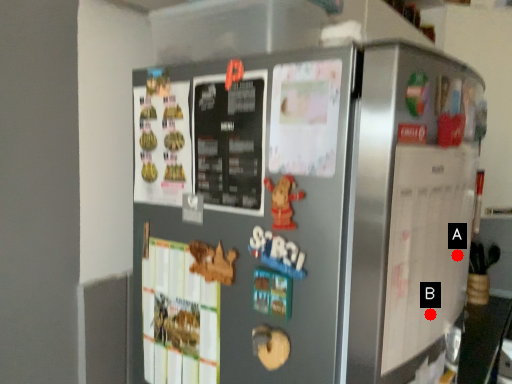
Question: Two points are circled on the image, labeled by A and B beside each circle. Which point appears farthest from the camera in this image?

Choices:
 (A) A is further
 (B) B is further

Answer: (A)